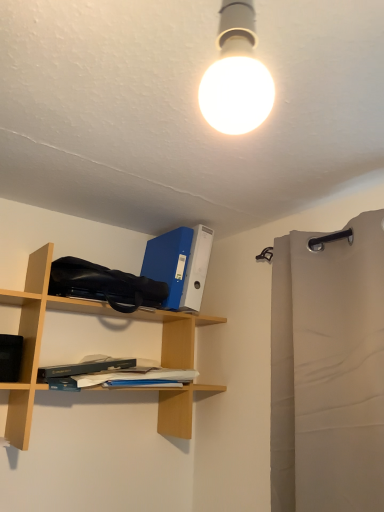
Question: From the image's perspective, is beige fabric curtain at right positioned above or below hardcover book at center?

Choices:
 (A) above
 (B) below

Answer: (A)

Question: Do you think beige fabric curtain at right is within hardcover book at center, or outside of it?

Choices:
 (A) outside
 (B) inside

Answer: (A)

Question: Estimate the real-world distances between objects in this image. Which object is closer to the hardcover book at center?

Choices:
 (A) beech wood shelf at left
 (B) beige fabric curtain at right

Answer: (A)

Question: Which object is the farthest from the beige fabric curtain at right?

Choices:
 (A) hardcover book at center
 (B) beech wood shelf at left

Answer: (B)